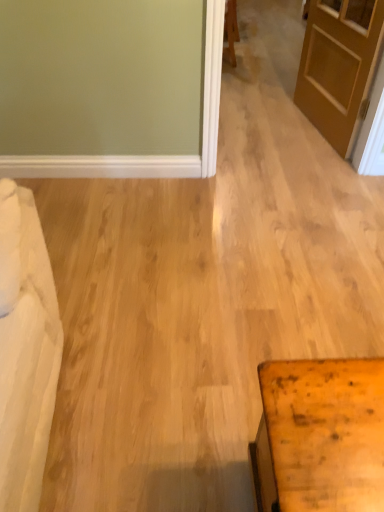
Identify the location of free point behind matte wooden door at upper right. (273, 100).